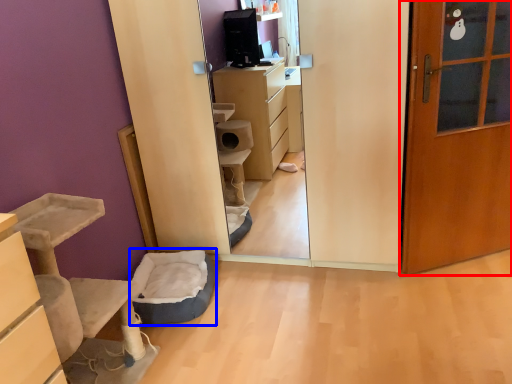
Question: Among these objects, which one is farthest to the camera, door (highlighted by a red box) or infant bed (highlighted by a blue box)?

Choices:
 (A) door
 (B) infant bed

Answer: (B)